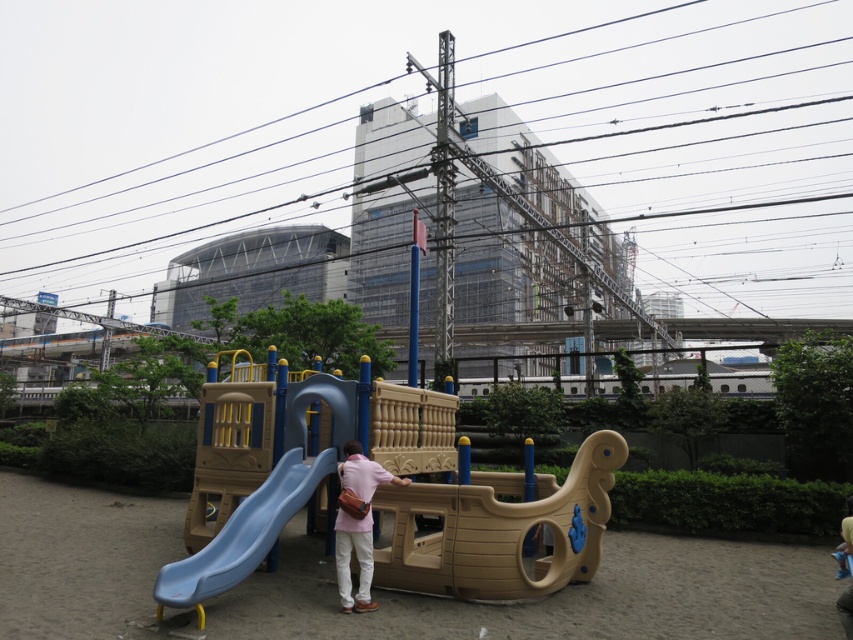
You are a drone operator trying to fly a drone through the playground area. The drone has a safety altitude requirement of 10 meters. Given the black wire at upper center, can you safely fly the drone at this altitude without hitting the wire?

The black wire at upper center is located at point (331, 102) in 2D coordinates. Since the drone must maintain a safety altitude of 10 meters, it can safely fly at this height as the wire is part of the playground structure which is much lower than the required altitude.

You are a parent supervising children playing at the playground. You notice the black wire at upper center and the blue plastic slide at lower left. Which object is located above the other?

The black wire at upper center is positioned over the blue plastic slide at lower left, meaning it is above the slide.